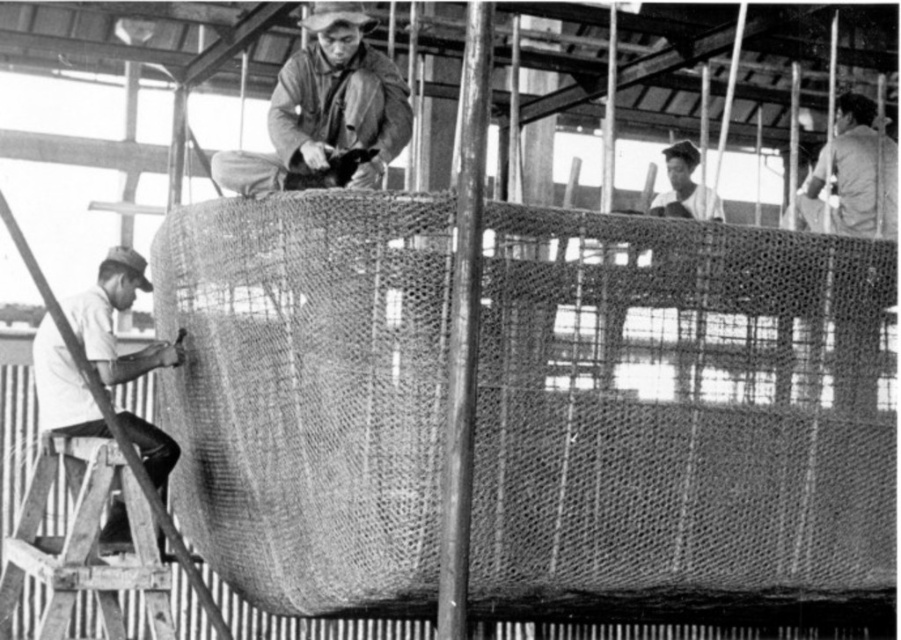
You are a safety inspector at the construction site. You notice two workers wearing a matte brown jacket at center and a white matte shirt at lower left. Which worker is positioned to the right side of the other?

The matte brown jacket at center is positioned to the right of the white matte shirt at lower left.

You are standing in front of the cylindrical structure and want to reach the two points marked on it. Which point, point (338,122) or point (877,164), is closer to you?

Point (338,122) is closer to the viewer than point (877,164).